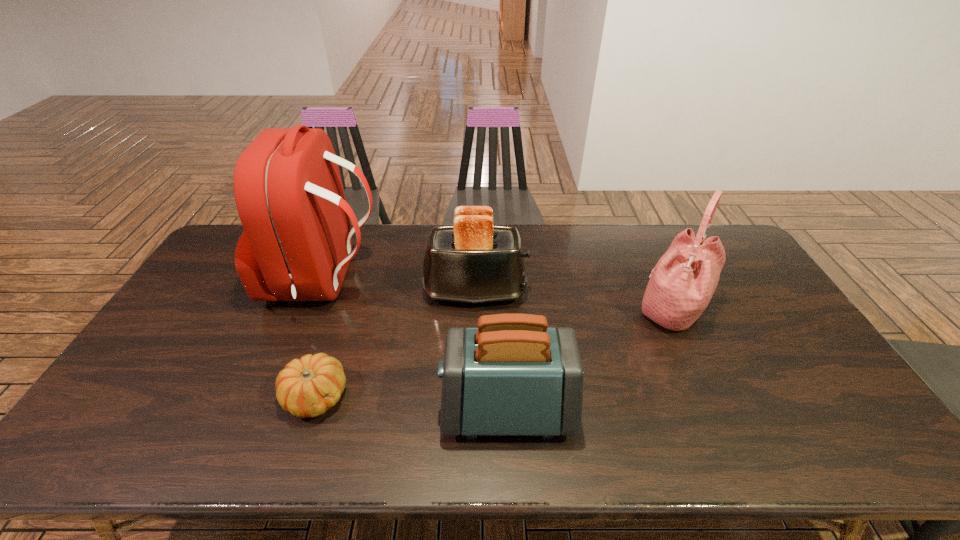
Select which object appears as the closest to the nearer toaster. Please provide its 2D coordinates. Your answer should be formatted as a tuple, i.e. [(x, y)], where the tuple contains the x and y coordinates of a point satisfying the conditions above.

[(473, 261)]

The height and width of the screenshot is (540, 960). I want to click on vacant area in the image that satisfies the following two spatial constraints: 1. on the side of the farther toaster with the control lever; 2. on the front side of the gourd, so click(474, 396).

Locate an element on the screen. Image resolution: width=960 pixels, height=540 pixels. vacant position in the image that satisfies the following two spatial constraints: 1. on the strap side of the rightmost object; 2. on the right side of the backpack is located at coordinates (313, 310).

I want to click on vacant space that satisfies the following two spatial constraints: 1. on the back side of the fourth shortest object; 2. on the side of the farther toaster with the control lever, so click(x=665, y=292).

Locate an element on the screen. The width and height of the screenshot is (960, 540). free location that satisfies the following two spatial constraints: 1. on the strap side of the backpack; 2. on the left side of the rightmost object is located at coordinates (313, 310).

Find the location of `vacant space that satisfies the following two spatial constraints: 1. on the back side of the handbag; 2. on the strap side of the tallest object`. vacant space that satisfies the following two spatial constraints: 1. on the back side of the handbag; 2. on the strap side of the tallest object is located at coordinates (660, 281).